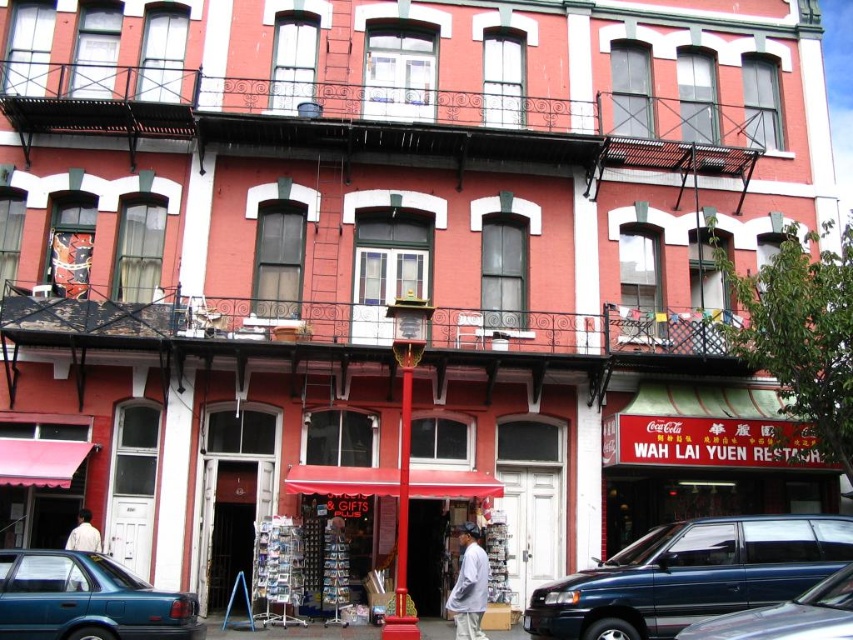
You are a delivery person standing in front of the building and need to park your vehicle. You see a metallic blue minivan at lower right and a white cotton shirt at lower left. Which parking spot can accommodate your large delivery van?

The metallic blue minivan at lower right is bigger than the white cotton shirt at lower left, so the parking spot where the metallic blue minivan at lower right is parked can accommodate your large delivery van since it can handle larger vehicles.

You are standing at the corner of the street looking at the three story red brick building with white trim. There is a point at coordinates (86, 600). What object is located at that point?

The teal glossy sedan at lower left is located at point (86, 600).

You are a delivery person who needs to park your metallic blue van at lower right near the red Coca Cola sign. However, there is a white cotton shirt at lower left in the way. Can you move the shirt to make space?

The metallic blue van at lower right is bigger than the white cotton shirt at lower left, so moving the white cotton shirt at lower left would be sufficient to make space for the van.